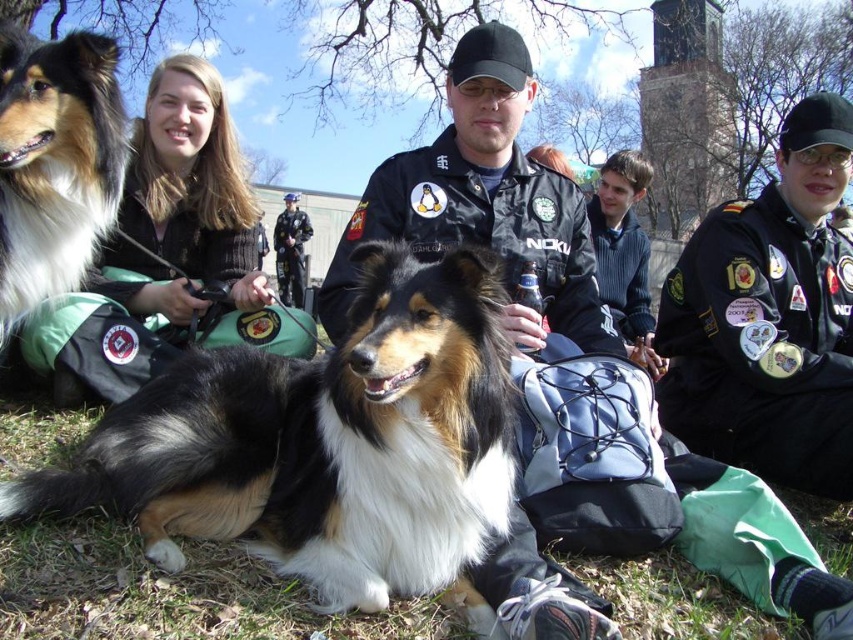
Question: Can you confirm if fuzzy green grass at lower center is positioned to the right of shiny black fur at center?

Choices:
 (A) no
 (B) yes

Answer: (B)

Question: Is black uniform at center bigger than blonde hair at center?

Choices:
 (A) yes
 (B) no

Answer: (A)

Question: Estimate the real-world distances between objects in this image. Which object is farther from the blonde hair at center?

Choices:
 (A) dark blue uniform at center
 (B) black uniform at center
 (C) shiny black fur at center

Answer: (A)

Question: Which point is closer to the camera?

Choices:
 (A) shaggy brown and white dog at center
 (B) black uniform at center
 (C) fuzzy green grass at lower center

Answer: (A)

Question: Based on their relative distances, which object is nearer to the black uniform at center?

Choices:
 (A) fuzzy green grass at lower center
 (B) shaggy brown and white dog at center
 (C) dark blue uniform at center
 (D) shiny black fur at center

Answer: (B)

Question: Considering the relative positions of shaggy brown and white dog at center and blonde hair at center in the image provided, where is shaggy brown and white dog at center located with respect to blonde hair at center?

Choices:
 (A) below
 (B) above

Answer: (A)